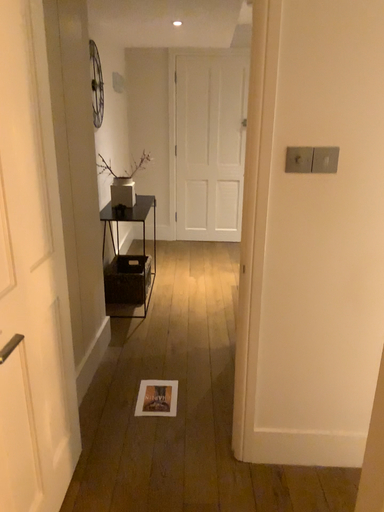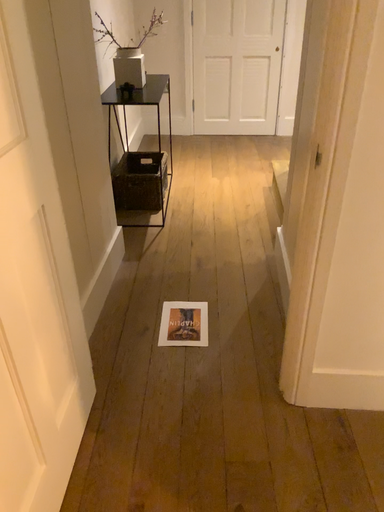
Question: How did the camera likely rotate when shooting the video?

Choices:
 (A) rotated upward
 (B) rotated downward

Answer: (B)